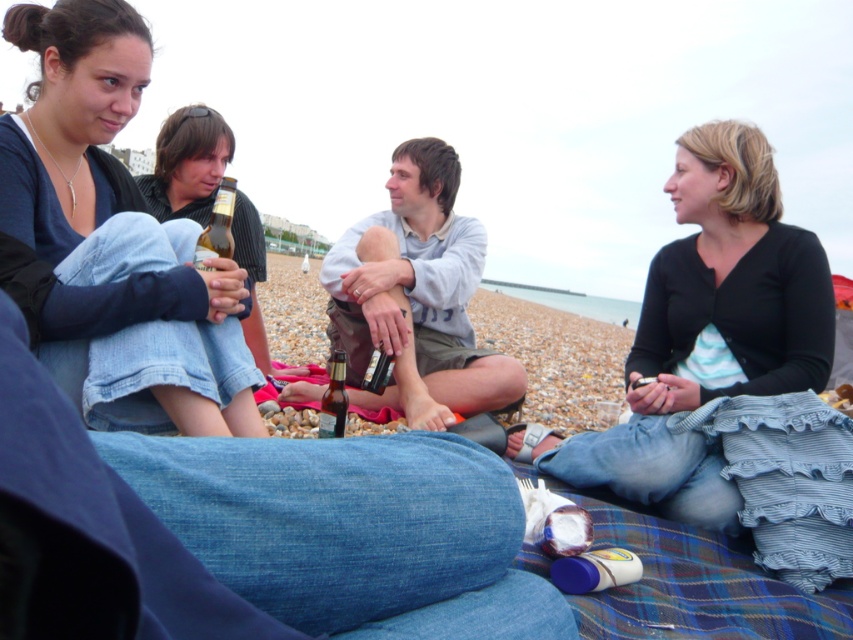
You are a photographer trying to capture a candid shot of the group. You want to ensure that the translucent plastic bottle at center is clearly visible in the photo. Given that the matte black shirt at left is blocking part of it, where should you position yourself relative to the group to avoid the obstruction?

Result: To ensure the translucent plastic bottle at center is visible without obstruction from the matte black shirt at left, position yourself to the right side of the group. This way, the matte black shirt at left will be out of the line of sight between you and the translucent plastic bottle at center.

You are organizing a beach cleanup and need to determine if the matte black shirt at left can be placed inside the translucent plastic bottle at center. Based on their sizes, is this possible?

The matte black shirt at left is larger in width than the translucent plastic bottle at center, so it cannot fit inside the bottle.

You are a photographer taking a picture of the scene. To ensure both the matte black shirt at left and the translucent plastic bottle at center are clearly visible in the photo, which object should you focus on first?

The matte black shirt at left is located above the translucent plastic bottle at center, so focusing on the matte black shirt at left first will ensure both are in focus as the bottle is below it.